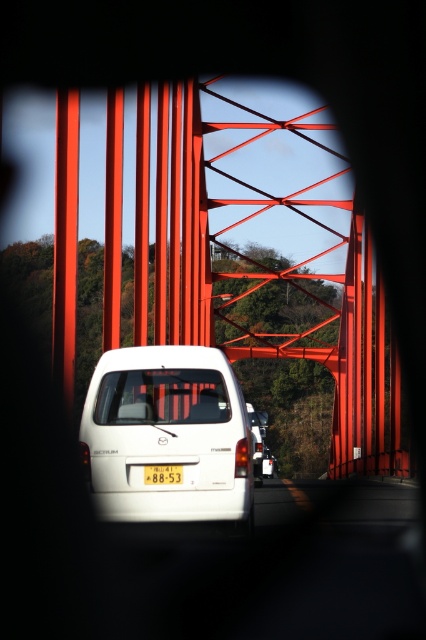
You are a photographer trying to capture the white matte van at center from above the metallic red bridge at center. Is the bridge in a position that would block your view of the van?

The metallic red bridge at center is positioned over the white matte van at center, so the bridge would block your view of the van from above.